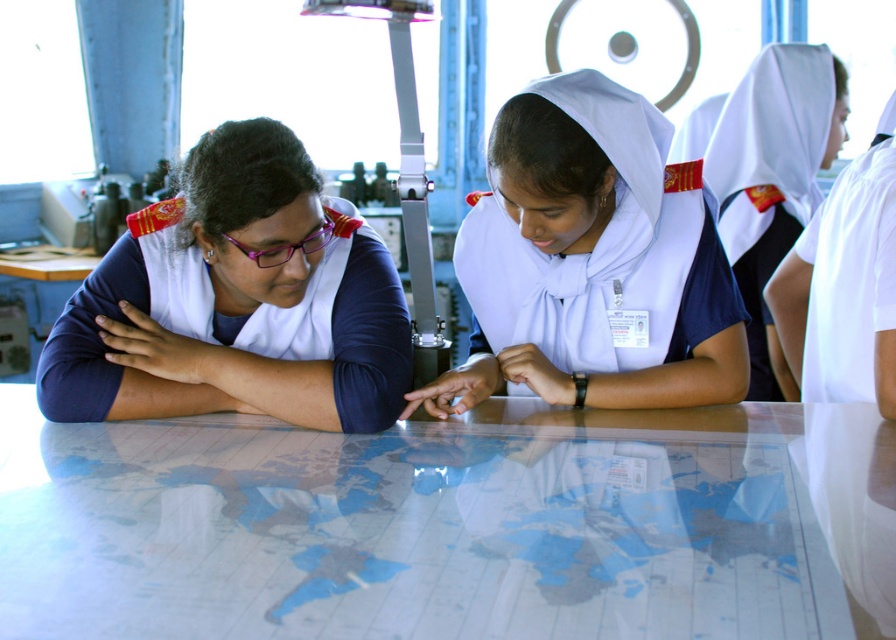
Question: Is matte blue uniform at left positioned before purple plastic glasses at upper left?

Choices:
 (A) no
 (B) yes

Answer: (B)

Question: Observing the image, what is the correct spatial positioning of matte blue uniform at left in reference to white matte uniform at center?

Choices:
 (A) right
 (B) left

Answer: (B)

Question: Among these points, which one is farthest from the camera?

Choices:
 (A) (199, 305)
 (B) (674, 396)
 (C) (731, 134)
 (D) (513, 616)

Answer: (C)

Question: Is transparent glass map at center bigger than white matte uniform at center?

Choices:
 (A) no
 (B) yes

Answer: (B)

Question: Estimate the real-world distances between objects in this image. Which object is farther from the purple plastic glasses at upper left?

Choices:
 (A) white uniform at upper right
 (B) transparent glass map at center
 (C) matte blue uniform at left

Answer: (A)

Question: Which of these objects is positioned closest to the white uniform at upper right?

Choices:
 (A) transparent glass map at center
 (B) matte blue uniform at left
 (C) white matte uniform at center
 (D) purple plastic glasses at upper left

Answer: (C)